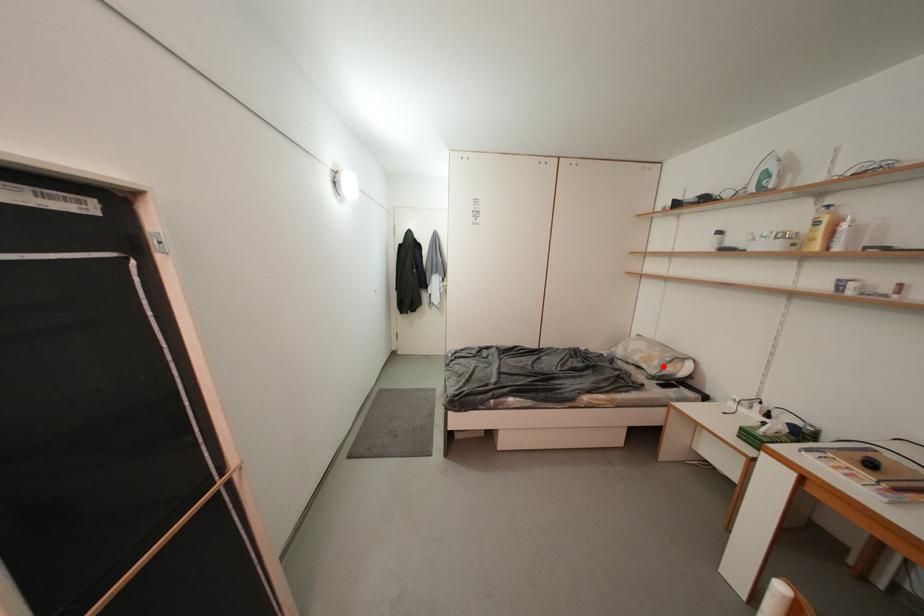
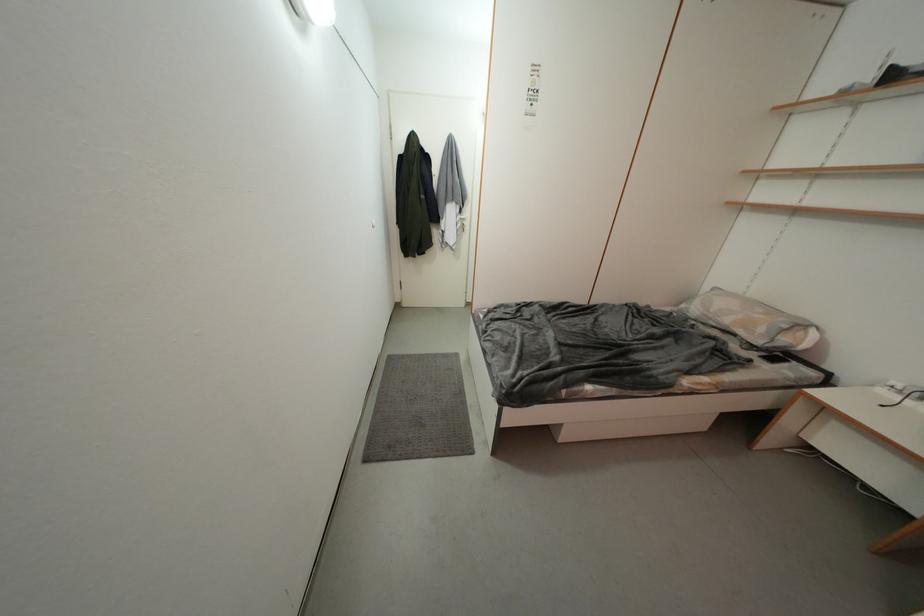
Question: I am providing you with two images of the same scene from different viewpoints. Given a red point in image1, look at the same physical point in image2. Is it:

Choices:
 (A) Closer to the viewpoint
 (B) Farther from the viewpoint

Answer: (B)